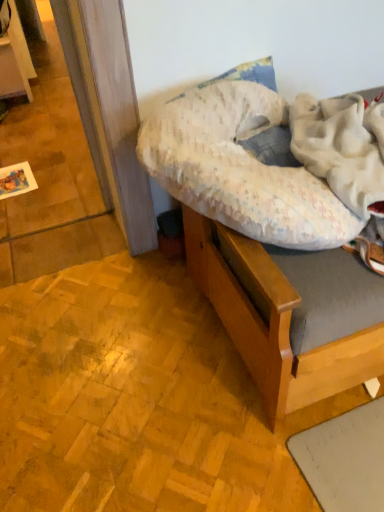
Question: Considering the positions of fluffy white pillow at center and wooden hospital bed at upper right in the image, is fluffy white pillow at center taller or shorter than wooden hospital bed at upper right?

Choices:
 (A) short
 (B) tall

Answer: (A)

Question: Is fluffy white pillow at center inside or outside of wooden hospital bed at upper right?

Choices:
 (A) outside
 (B) inside

Answer: (B)

Question: Is fluffy white pillow at center bigger or smaller than wooden hospital bed at upper right?

Choices:
 (A) big
 (B) small

Answer: (B)

Question: Considering the positions of wooden hospital bed at upper right and fluffy white pillow at center in the image, is wooden hospital bed at upper right bigger or smaller than fluffy white pillow at center?

Choices:
 (A) big
 (B) small

Answer: (A)

Question: Considering the positions of wooden hospital bed at upper right and fluffy white pillow at center in the image, is wooden hospital bed at upper right wider or thinner than fluffy white pillow at center?

Choices:
 (A) wide
 (B) thin

Answer: (A)

Question: In terms of height, does wooden hospital bed at upper right look taller or shorter compared to fluffy white pillow at center?

Choices:
 (A) short
 (B) tall

Answer: (B)

Question: Is point (286, 292) closer or farther from the camera than point (342, 243)?

Choices:
 (A) closer
 (B) farther

Answer: (A)